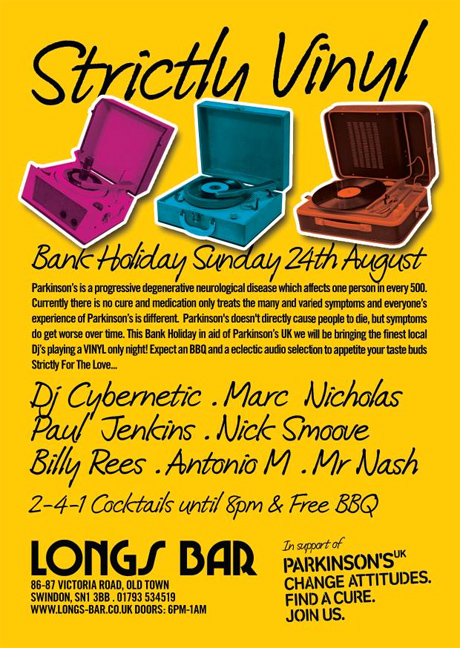
At what (x,y) coordinates should I click in order to perform the action: click on purple tinted record player. Please return your answer as a coordinate pair (x, y). This screenshot has width=460, height=648. Looking at the image, I should click on (33, 170).